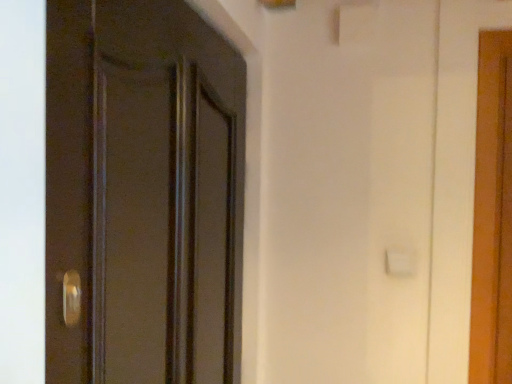
What do you see at coordinates (142, 195) in the screenshot? I see `dark wood door at left` at bounding box center [142, 195].

Find the location of a particular element. dark wood door at left is located at coordinates (142, 195).

The height and width of the screenshot is (384, 512). In order to click on dark wood door at left in this screenshot , I will do `click(142, 195)`.